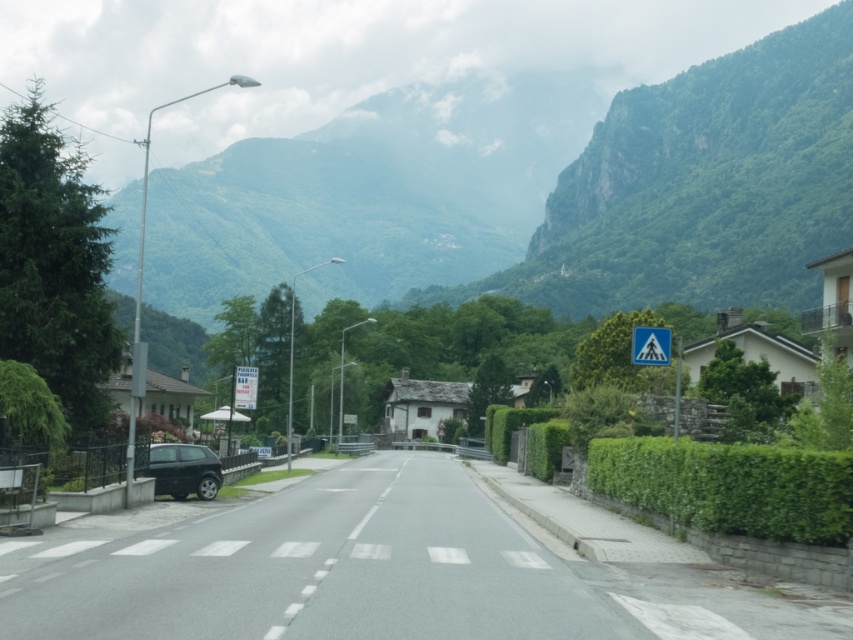
You are driving a car that is 4 meters long. You need to park your car between the shiny black car at lower left and the white plastic sign at left. Is there enough space between them to park your car?

The distance between the shiny black car at lower left and the white plastic sign at left is 20.08 meters. Since your car is only 4 meters long, there is ample space to park between them.

Based on the photo, you are driving a car and need to park. You see a shiny black car at lower left and a white plastic pedestrian crossing sign at right. Which object is bigger and would require more space to avoid?

The shiny black car at lower left is larger in size than the white plastic pedestrian crossing sign at right, so you should prioritize avoiding the shiny black car at lower left as it requires more space.

You are driving a car that is 5 meters long and want to make a U turn on the road. The road is straight ahead and has a shiny black car at lower left parked near a metal fence and a white plastic pedestrian crossing sign at right. Can your car complete the U turn without crossing the road or touching any obstacles?

The distance between the shiny black car at lower left and the white plastic pedestrian crossing sign at right is 13.64 meters. Since your car is 5 meters long, you need at least twice the length of your car for a U turn, which would require 10 meters. Since 13.64 meters is more than 10 meters, you can complete the U turn without crossing the road or touching any obstacles.